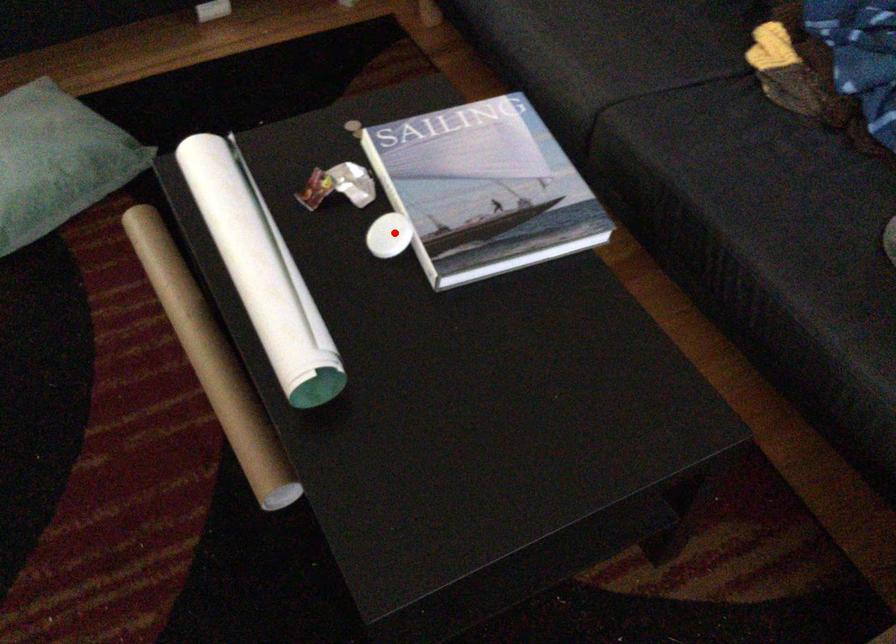
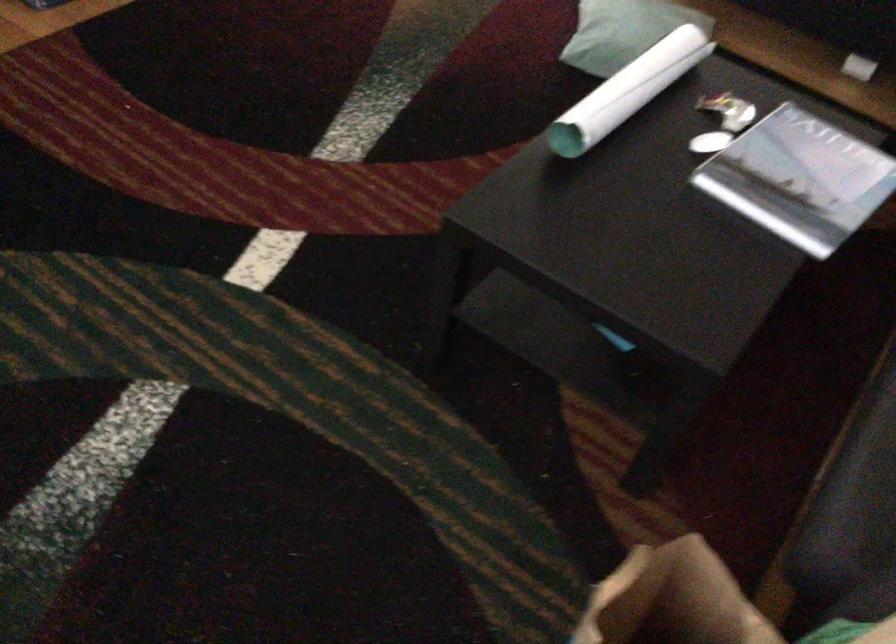
Question: I am providing you with two images of the same scene from different viewpoints. In image1, a red point is highlighted. Considering the same 3D point in image2, which of the following is correct?

Choices:
 (A) It is closer
 (B) It is farther

Answer: (B)